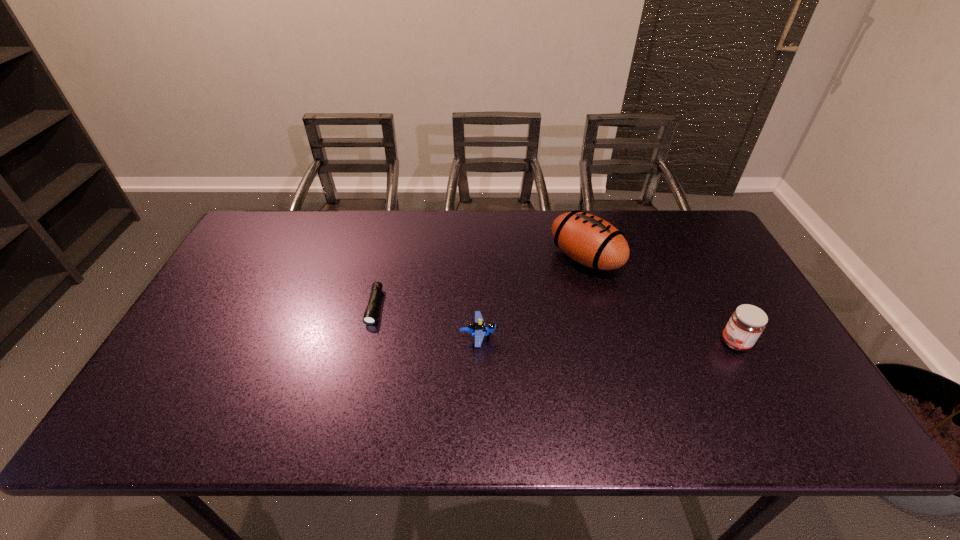
This screenshot has height=540, width=960. What are the coordinates of `the third object from left to right` in the screenshot? It's located at (589, 240).

I want to click on the tallest object, so click(x=589, y=240).

Identify the location of jam. (747, 322).

Locate an element on the screen. The width and height of the screenshot is (960, 540). the second tallest object is located at coordinates (747, 322).

Identify the location of Lego. Image resolution: width=960 pixels, height=540 pixels. (478, 329).

You are a GUI agent. You are given a task and a screenshot of the screen. Output one action in this format:
    pyautogui.click(x=<x>, y=<y>)
    Task: Click on the second object from left to right
    This screenshot has height=540, width=960.
    Given the screenshot: What is the action you would take?
    pyautogui.click(x=478, y=329)

Where is `flashlight`? The width and height of the screenshot is (960, 540). flashlight is located at coordinates (370, 314).

Locate an element on the screen. the leftmost object is located at coordinates (370, 314).

Find the location of a particular element. vacant space located 0.180m on the left of the tallest object is located at coordinates (493, 258).

This screenshot has width=960, height=540. I want to click on vacant region located on the front of the rightmost object, so click(x=783, y=433).